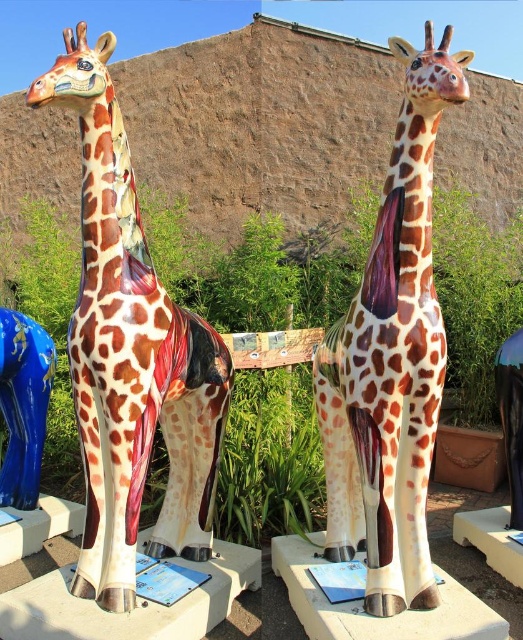
Between polished ceramic giraffe at left and glossy ceramic giraffe at center, which one has less height?

glossy ceramic giraffe at center

You are a GUI agent. You are given a task and a screenshot of the screen. Output one action in this format:
    pyautogui.click(x=<x>, y=<y>)
    Task: Click on the polished ceramic giraffe at left
    
    Given the screenshot: What is the action you would take?
    pyautogui.click(x=130, y=355)

Does blue glossy vase at lower left come in front of blue glossy sign at center?

No, it is not.

Does blue glossy vase at lower left appear on the right side of blue glossy sign at center?

In fact, blue glossy vase at lower left is to the left of blue glossy sign at center.

Is point (35, 401) positioned after point (158, 589)?

Yes, point (35, 401) is behind point (158, 589).

Locate an element on the screen. This screenshot has height=640, width=523. blue glossy vase at lower left is located at coordinates (24, 404).

Does point (85, 51) come behind point (9, 451)?

No, (85, 51) is closer to viewer.

Between point (115, 269) and point (36, 451), which one is positioned in front?

Positioned in front is point (115, 269).

The width and height of the screenshot is (523, 640). I want to click on polished ceramic giraffe at left, so click(x=130, y=355).